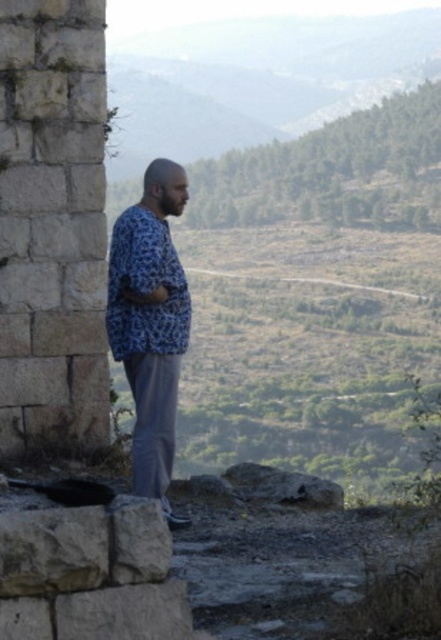
Question: Which point appears farthest from the camera in this image?

Choices:
 (A) (67, 396)
 (B) (130, 285)

Answer: (A)

Question: Which point is closer to the camera?

Choices:
 (A) (146, 492)
 (B) (66, 196)

Answer: (A)

Question: Does white stone wall at left have a greater width compared to blue printed shirt at center?

Choices:
 (A) yes
 (B) no

Answer: (A)

Question: Is white stone wall at left to the left of blue printed shirt at center from the viewer's perspective?

Choices:
 (A) no
 (B) yes

Answer: (B)

Question: Which point appears farthest from the camera in this image?

Choices:
 (A) (37, 227)
 (B) (160, 460)

Answer: (A)

Question: Does white stone wall at left have a lesser width compared to blue printed shirt at center?

Choices:
 (A) yes
 (B) no

Answer: (B)